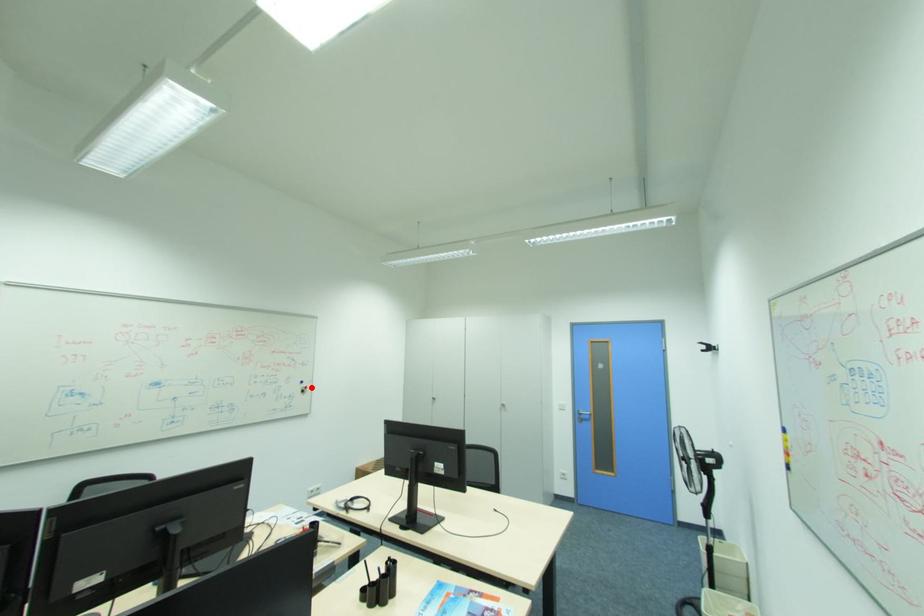
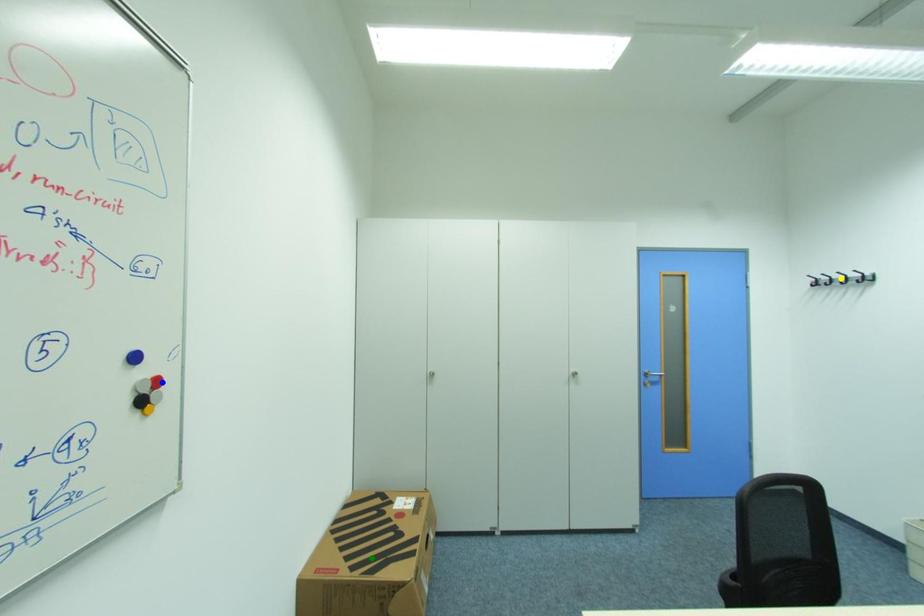
Question: I am providing you with two images of the same scene from different viewpoints. A red point is marked on the first image. You are given multiple points on the second image. Can you choose the point in image 2 that corresponds to the point in image 1?

Choices:
 (A) blue point
 (B) yellow point
 (C) green point

Answer: (A)